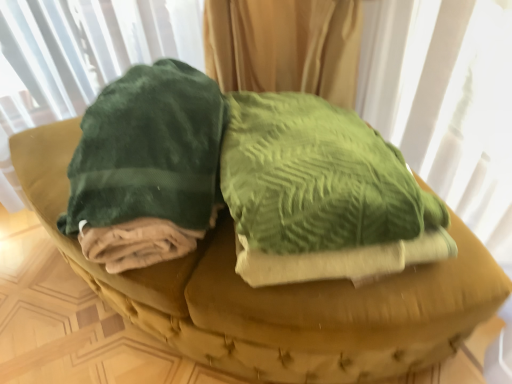
Question: From the image's perspective, is velvet green cushion at center located above or below velvety green blanket at left?

Choices:
 (A) below
 (B) above

Answer: (A)

Question: Do you think velvet green cushion at center is within velvety green blanket at left, or outside of it?

Choices:
 (A) inside
 (B) outside

Answer: (B)

Question: In terms of width, does velvet green cushion at center look wider or thinner when compared to velvety green blanket at left?

Choices:
 (A) wide
 (B) thin

Answer: (A)

Question: In the image, is velvety green blanket at left positioned in front of or behind velvet green cushion at center?

Choices:
 (A) behind
 (B) front

Answer: (A)

Question: In terms of width, does velvety green blanket at left look wider or thinner when compared to velvet green cushion at center?

Choices:
 (A) wide
 (B) thin

Answer: (B)

Question: Is velvety green blanket at left inside the boundaries of velvet green cushion at center, or outside?

Choices:
 (A) outside
 (B) inside

Answer: (A)

Question: Considering the positions of point (131, 201) and point (148, 316), is point (131, 201) closer or farther from the camera than point (148, 316)?

Choices:
 (A) closer
 (B) farther

Answer: (A)